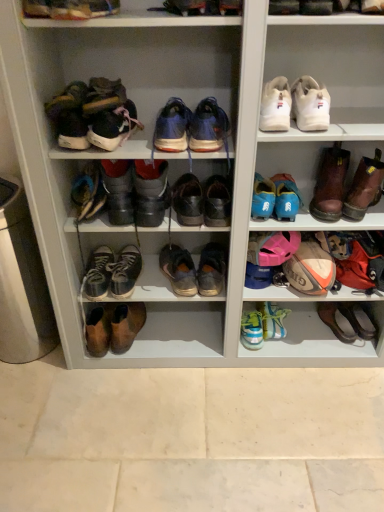
The height and width of the screenshot is (512, 384). In order to click on vacant space underneath worn leather shoes at center, the 5th shoe from the left (from a real-world perspective) in this screenshot , I will do `click(212, 333)`.